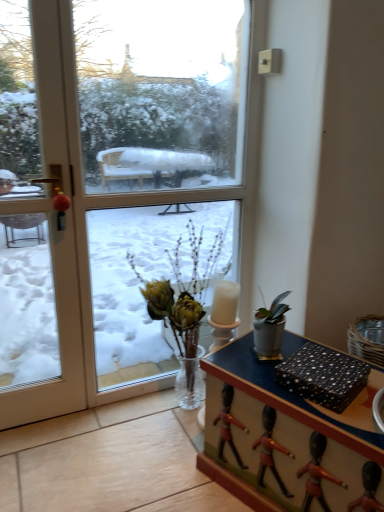
Where is `blank space situated above black dotted paper at lower right (from a real-world perspective)`? This screenshot has width=384, height=512. blank space situated above black dotted paper at lower right (from a real-world perspective) is located at coordinates (325, 364).